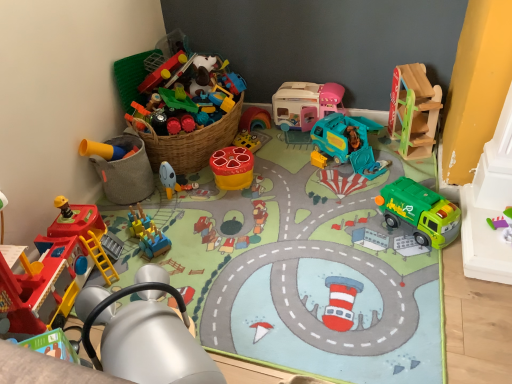
At what (x,y) coordinates should I click in order to perform the action: click on empty space that is in between green plastic garbage truck at lower right, which is the 8th toy in left-to-right order, and matte plastic stool at center, the 5th toy from the right. Please return your answer as a coordinate pair (x, y). Looking at the image, I should click on (316, 199).